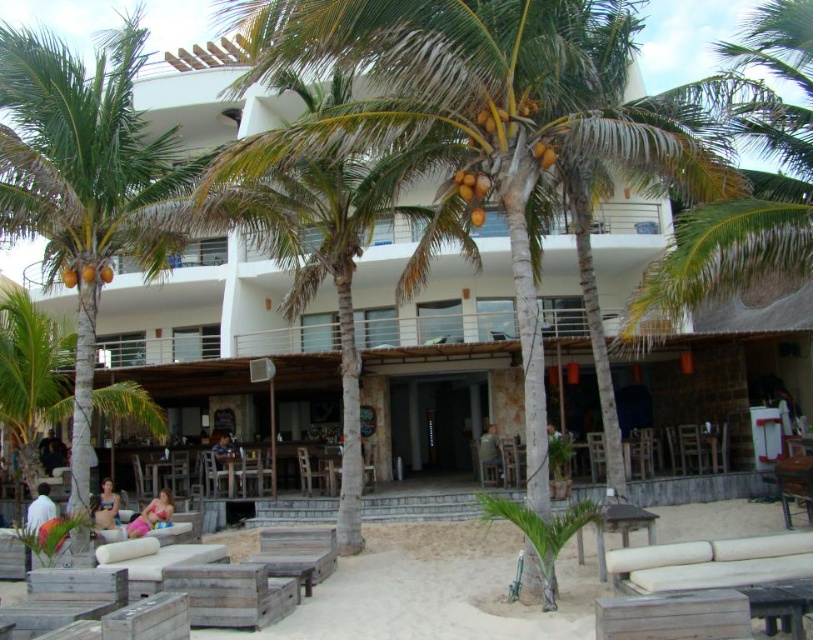
Is point (494, 426) closer to viewer compared to point (96, 499)?

No.

Who is taller, light brown wooden chair at center or pink fabric person at lower left?

With more height is light brown wooden chair at center.

Which is behind, point (500, 467) or point (111, 480)?

The point (111, 480) is more distant.

In order to click on light brown wooden chair at center in this screenshot , I will do `click(490, 456)`.

Which is behind, point (737, 529) or point (354, 248)?

Positioned behind is point (354, 248).

Measure the distance between wooden lounge chairs at lower center and camera.

The distance of wooden lounge chairs at lower center from camera is 7.99 meters.

Is point (668, 506) less distant than point (333, 243)?

No, (668, 506) is behind (333, 243).

What are the coordinates of `wooden lounge chairs at lower center` in the screenshot? It's located at (437, 589).

Is point (103, 202) closer to viewer compared to point (768, 525)?

Yes.

Who is shorter, green leafy palm tree at left or wooden lounge chairs at lower center?

wooden lounge chairs at lower center

Measure the distance between green leafy palm tree at left and camera.

The distance of green leafy palm tree at left from camera is 33.82 feet.

Where is `green leafy palm tree at left`? This screenshot has height=640, width=813. green leafy palm tree at left is located at coordinates (85, 182).